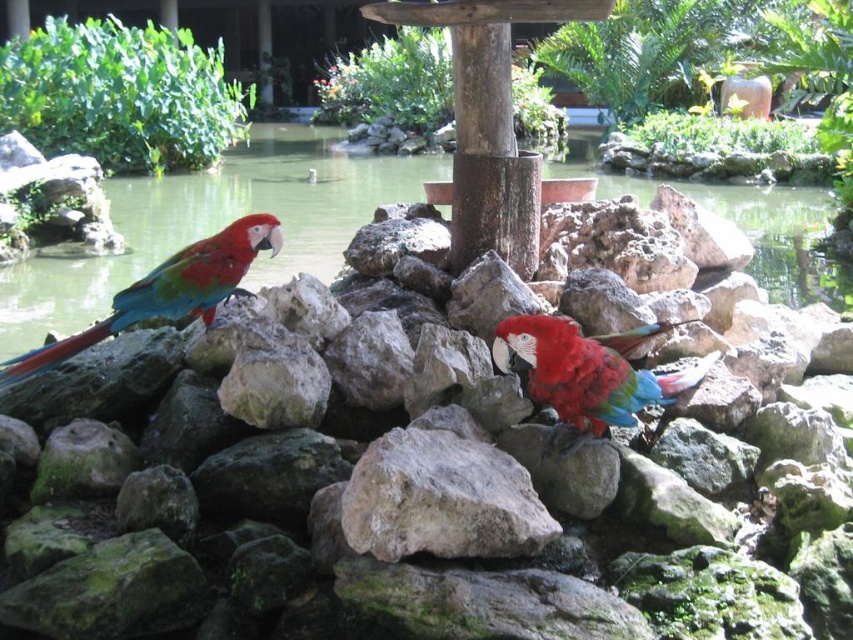
Question: From the image, what is the correct spatial relationship of greenish water at center in relation to gray rough rock at center?

Choices:
 (A) left
 (B) right

Answer: (B)

Question: Is greenish water at center to the right of gray rough rock at center from the viewer's perspective?

Choices:
 (A) yes
 (B) no

Answer: (A)

Question: Does green mossy rock at center appear over shiny multicolored parrot at center?

Choices:
 (A) yes
 (B) no

Answer: (A)

Question: Which object is the farthest from the shiny multicolored parrot at center?

Choices:
 (A) greenish water at center
 (B) green mossy rock at center
 (C) gray rough rock at center
 (D) shiny green parrot at left

Answer: (A)

Question: Estimate the real-world distances between objects in this image. Which object is farther from the shiny multicolored parrot at center?

Choices:
 (A) greenish water at center
 (B) shiny green parrot at left

Answer: (A)

Question: Which of the following is the closest to the observer?

Choices:
 (A) greenish water at center
 (B) shiny multicolored parrot at center
 (C) gray rough rock at center
 (D) shiny green parrot at left

Answer: (C)